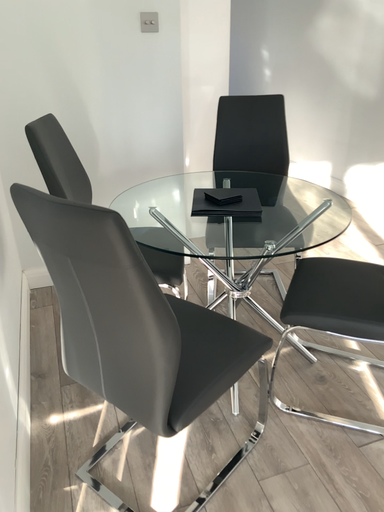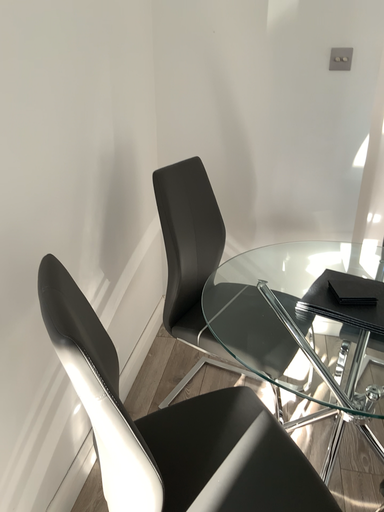
Question: How did the camera likely rotate when shooting the video?

Choices:
 (A) rotated left
 (B) rotated right

Answer: (A)